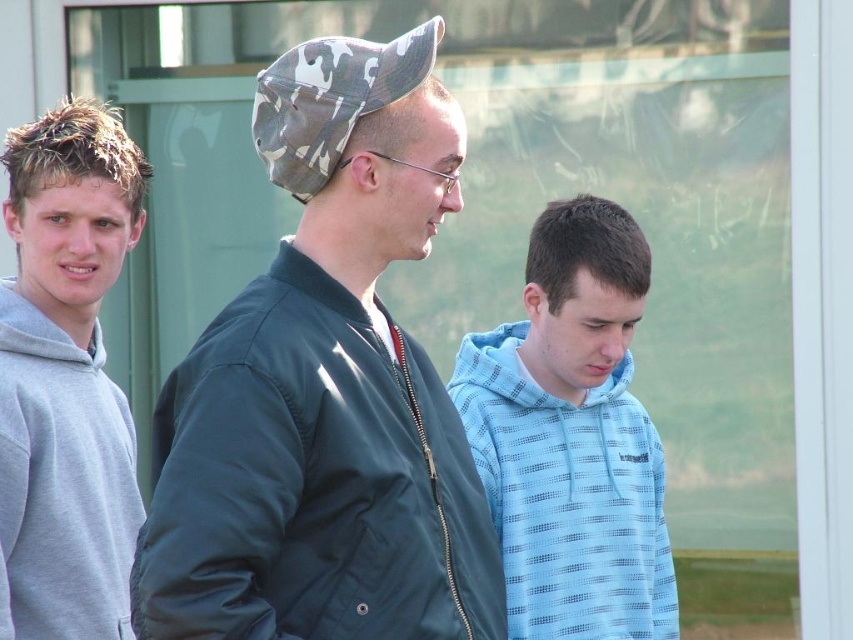
You are a photographer trying to capture a group photo of the three people. You notice the light blue hoodie at center and the camouflage fabric baseball cap at center. Which object should you focus on first if you want to ensure both are in focus, considering their sizes?

The light blue hoodie at center is larger in size than the camouflage fabric baseball cap at center, so focusing on the larger object first would help ensure both are in focus.

You are a photographer trying to capture a group photo of the dark green jacket at center and the gray fleece hoodie at left. The camera you are using has a maximum focus range of 6 feet. Can you fit both subjects within the camera frame without moving either of them?

The distance between the dark green jacket at center and the gray fleece hoodie at left is 5.60 feet, which is within the camera maximum focus range of 6 feet. Therefore, you can fit both subjects within the camera frame without moving them.